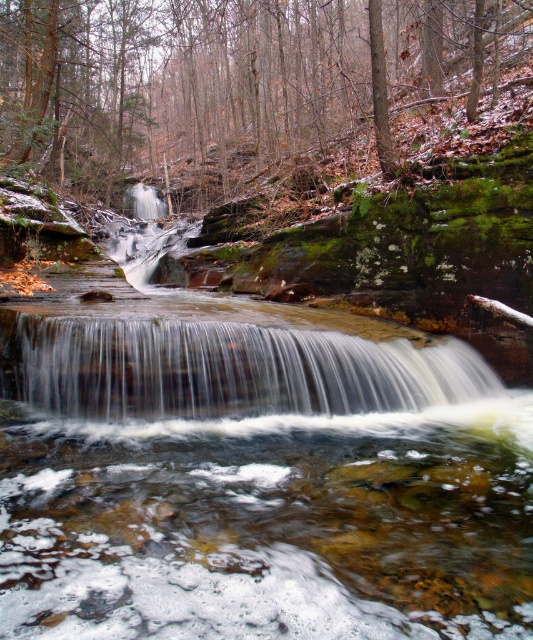
You are standing at the edge of the stream and want to place a small stone on the green mossy rocks at center and the white frothy water at center. Which location is to the right?

The white frothy water at center is to the right of the green mossy rocks at center, so placing the stone there would be on the right side.

You are standing at the waterfall and want to walk towards the two points marked in the image. Which point will you reach first, point (28, 10) or point (133, 396)?

You will reach point (28, 10) first because it is closer to you than point (133, 396), which is further away.

You are a hiker carrying a backpack and want to cross the stream shown in the image. The stream is between the green mossy rocks at center and the white frothy water at center. Can you safely cross the stream if your maximum safe crossing distance is 50 feet?

The distance between the green mossy rocks at center and white frothy water at center is 66.65 feet, which exceeds your maximum safe crossing distance of 50 feet. Therefore, it is not safe to cross the stream.